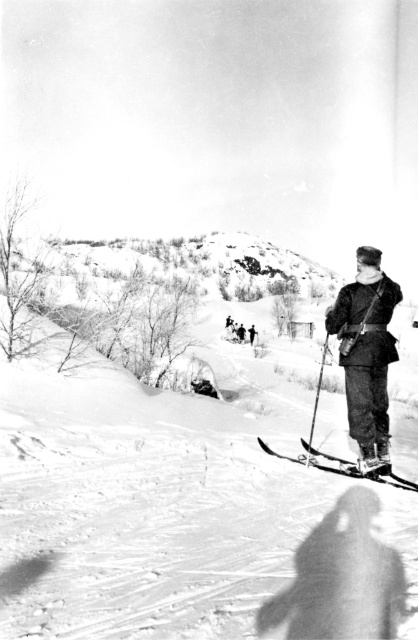
You are an observer in the snowy landscape. You notice the dark woolen coat at right and the metallic skis at center. Which object is taller?

The dark woolen coat at right is taller than the metallic skis at center.